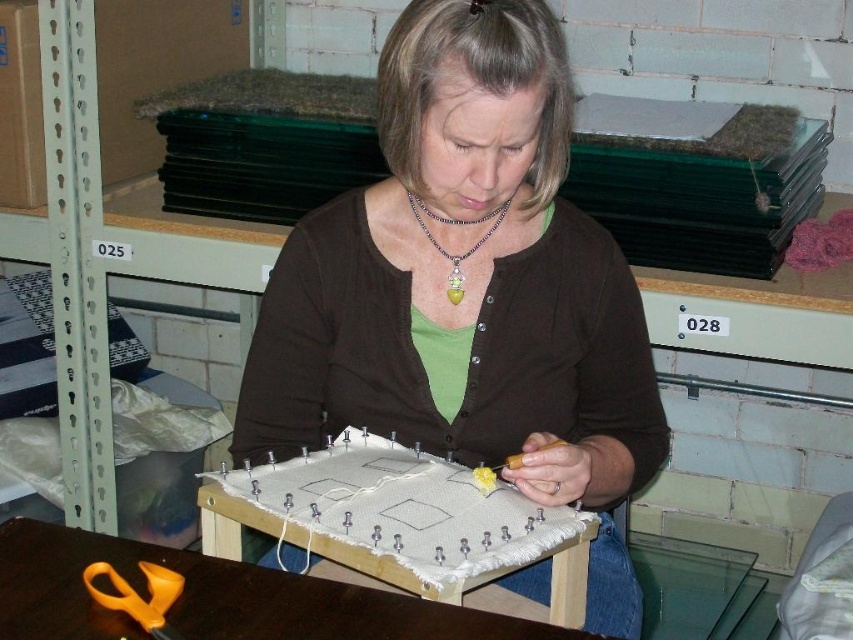
Does yellow plastic scissors at lower left have a lesser width compared to shiny silver necklace with green pendant at center?

Yes.

How far apart are yellow plastic scissors at lower left and shiny silver necklace with green pendant at center?

The distance of yellow plastic scissors at lower left from shiny silver necklace with green pendant at center is 20.20 inches.

What do you see at coordinates (138, 595) in the screenshot? The width and height of the screenshot is (853, 640). I see `yellow plastic scissors at lower left` at bounding box center [138, 595].

Locate an element on the screen. The width and height of the screenshot is (853, 640). yellow plastic scissors at lower left is located at coordinates (138, 595).

In the scene shown: Between brown matte sweater at center and yellow plastic scissors at lower left, which one appears on the left side from the viewer's perspective?

From the viewer's perspective, yellow plastic scissors at lower left appears more on the left side.

Where is `brown matte sweater at center`? The image size is (853, 640). brown matte sweater at center is located at coordinates (468, 292).

This screenshot has height=640, width=853. Find the location of `brown matte sweater at center`. brown matte sweater at center is located at coordinates (468, 292).

Can you confirm if wooden table at lower center is bigger than yellow plastic scissors at lower left?

Indeed, wooden table at lower center has a larger size compared to yellow plastic scissors at lower left.

In the scene shown: Is wooden table at lower center thinner than yellow plastic scissors at lower left?

Incorrect, wooden table at lower center's width is not less than yellow plastic scissors at lower left's.

Is point (172, 554) positioned in front of point (113, 584)?

That is False.

I want to click on wooden table at lower center, so click(x=215, y=596).